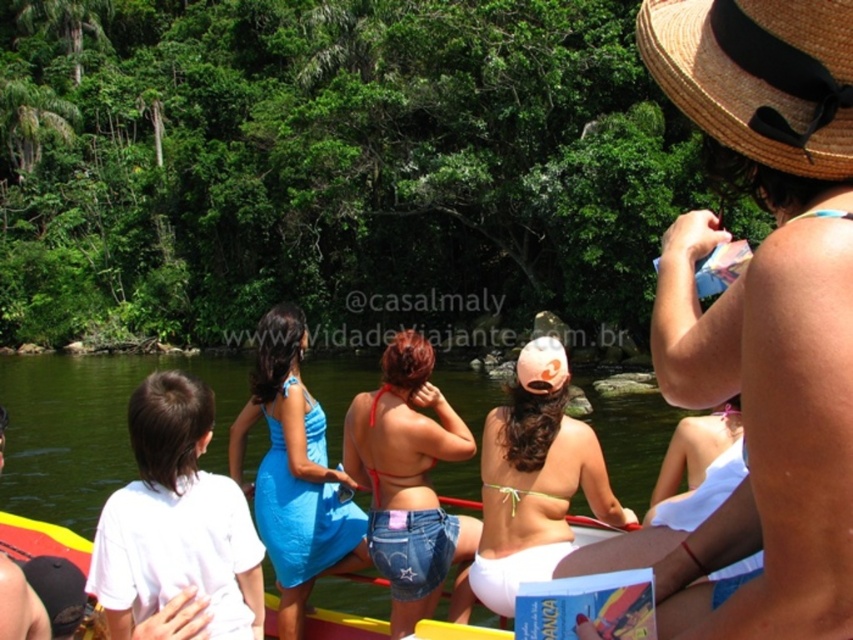
Question: Which of the following is the closest to the observer?

Choices:
 (A) blue satin dress at center
 (B) white bikini at center
 (C) white cotton shirt at lower left
 (D) strawmaterial/texturehat at upper right

Answer: (D)

Question: Does white bikini at center appear under white cotton shirt at lower left?

Choices:
 (A) yes
 (B) no

Answer: (B)

Question: Is the position of denim shorts at center more distant than that of white bikini at center?

Choices:
 (A) yes
 (B) no

Answer: (A)

Question: Is denim shorts at center smaller than white bikini at center?

Choices:
 (A) yes
 (B) no

Answer: (B)

Question: Which object appears closest to the camera in this image?

Choices:
 (A) white bikini at center
 (B) white cotton shirt at lower left

Answer: (B)

Question: Which point is closer to the camera?

Choices:
 (A) (379, 404)
 (B) (120, 579)
 (C) (282, 435)

Answer: (B)